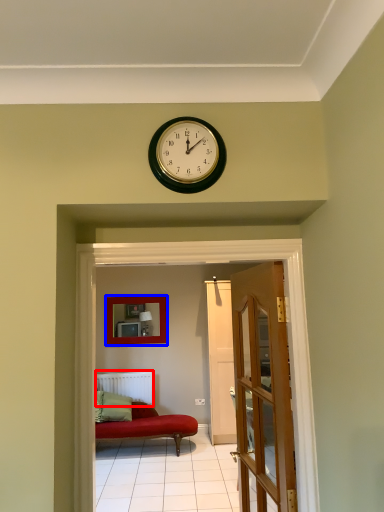
Question: Which of the following is the farthest to the observer, radiator (highlighted by a red box) or picture frame (highlighted by a blue box)?

Choices:
 (A) radiator
 (B) picture frame

Answer: (B)